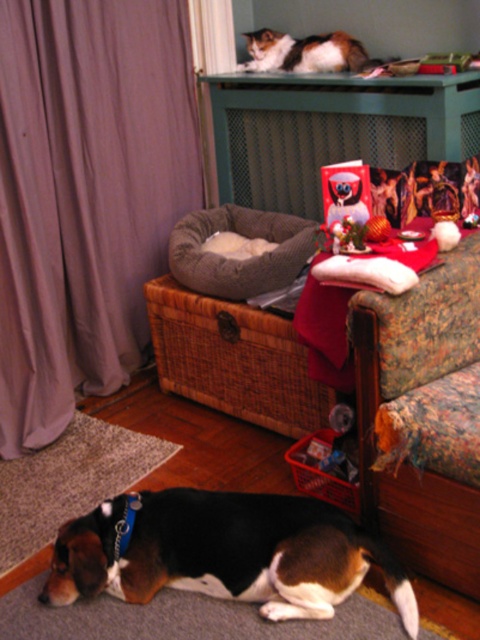
Consider the image. Is gray plush dog bed at center to the left of calico fur cat at upper center from the viewer's perspective?

Yes, gray plush dog bed at center is to the left of calico fur cat at upper center.

Does gray plush dog bed at center appear on the right side of calico fur cat at upper center?

In fact, gray plush dog bed at center is to the left of calico fur cat at upper center.

What do you see at coordinates (237, 260) in the screenshot? This screenshot has width=480, height=640. I see `gray plush dog bed at center` at bounding box center [237, 260].

I want to click on gray plush dog bed at center, so click(x=237, y=260).

Can you confirm if purple fabric curtain at left is shorter than gray plush dog bed at center?

No.

This screenshot has height=640, width=480. I want to click on purple fabric curtain at left, so click(x=85, y=195).

This screenshot has width=480, height=640. What are the coordinates of `purple fabric curtain at left` in the screenshot? It's located at tap(85, 195).

Is point (405, 348) positioned behind point (338, 202)?

That is False.

Is point (412, 483) farther from camera compared to point (335, 179)?

That is False.

Find the location of `floral fabric couch at lower right`. floral fabric couch at lower right is located at coordinates (402, 397).